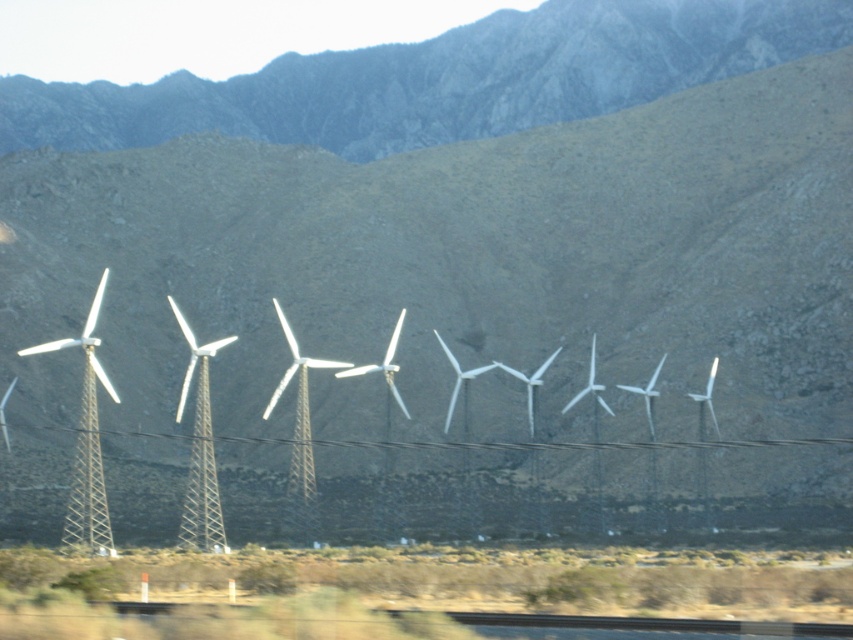
Who is lower down, white metallic windmill at left or metallic silver power line at center?

Positioned lower is metallic silver power line at center.

Between point (94, 417) and point (561, 445), which one is positioned in front?

Point (94, 417) is more forward.

Is point (97, 449) farther from camera compared to point (563, 444)?

No.

This screenshot has height=640, width=853. Identify the location of white metallic windmill at left. (86, 444).

What do you see at coordinates (86, 442) in the screenshot? The height and width of the screenshot is (640, 853). I see `white metallic wind turbines at center` at bounding box center [86, 442].

Measure the distance between white metallic wind turbines at center and camera.

They are 77.88 meters apart.

You are a GUI agent. You are given a task and a screenshot of the screen. Output one action in this format:
    pyautogui.click(x=<x>, y=<y>)
    Task: Click on the white metallic wind turbines at center
    
    Given the screenshot: What is the action you would take?
    pyautogui.click(x=86, y=442)

Who is more forward, (302, 429) or (224, 538)?

Point (224, 538) is in front.

Looking at this image, is white metallic wind turbines at center bigger than white metallic windmill at center?

Yes.

Which is behind, point (303, 371) or point (202, 497)?

The point (303, 371) is behind.

At what (x,y) coordinates should I click in order to perform the action: click on white metallic wind turbines at center. Please return your answer as a coordinate pair (x, y). The image size is (853, 640). Looking at the image, I should click on (86, 442).